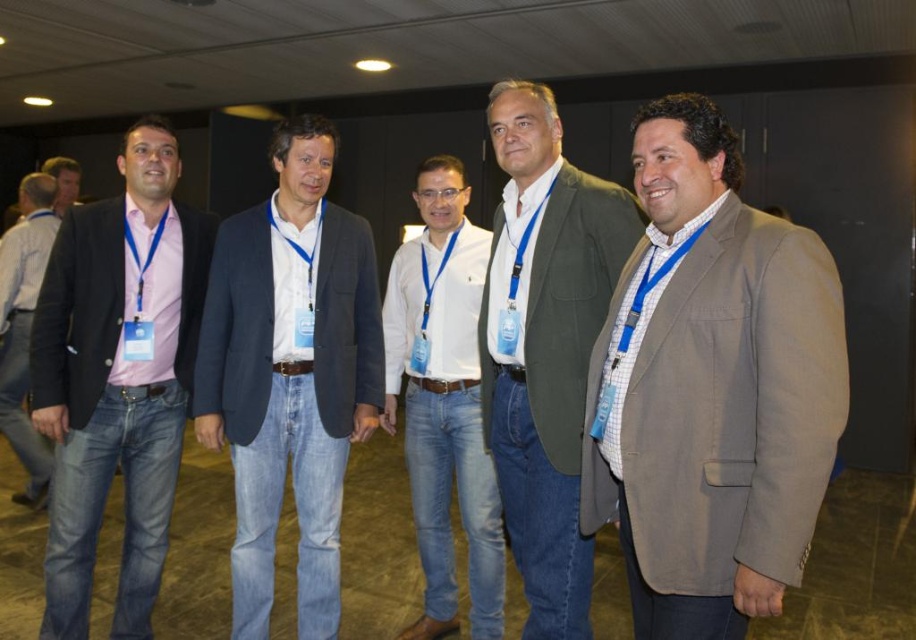
You are organizing a photo shoot and need to ensure that the white glossy shirt at center and the white fabric tie at center are visible in the frame. Given that the shirt is wider than the tie, which object should you adjust your camera angle to focus on first to capture both effectively?

The white glossy shirt at center is wider than the white fabric tie at center, so you should focus on the white glossy shirt at center first to ensure it fits in the frame before adjusting for the narrower white fabric tie at center.

You are standing in the conference room and need to identify the exact position of the gray textured blazer at center. Can you determine its coordinates based on the room layout?

The gray textured blazer at center is located at point (711, 388).